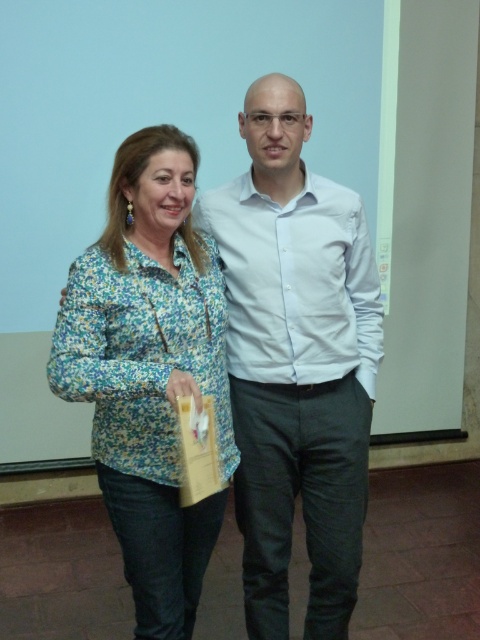
Based on the photo, does white smooth shirt at center have a greater width compared to floral fabric jacket at left?

Yes, white smooth shirt at center is wider than floral fabric jacket at left.

You are a GUI agent. You are given a task and a screenshot of the screen. Output one action in this format:
    pyautogui.click(x=<x>, y=<y>)
    Task: Click on the white smooth shirt at center
    
    Given the screenshot: What is the action you would take?
    pyautogui.click(x=296, y=362)